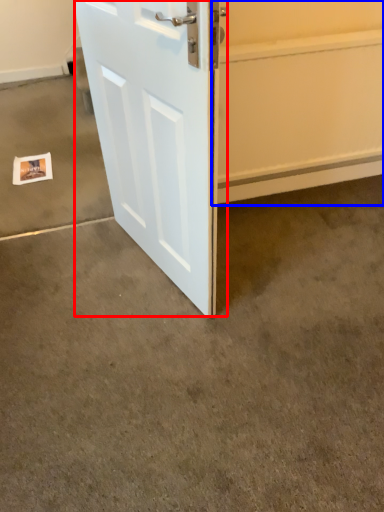
Question: Which of the following is the closest to the observer, door (highlighted by a red box) or garage door (highlighted by a blue box)?

Choices:
 (A) door
 (B) garage door

Answer: (A)